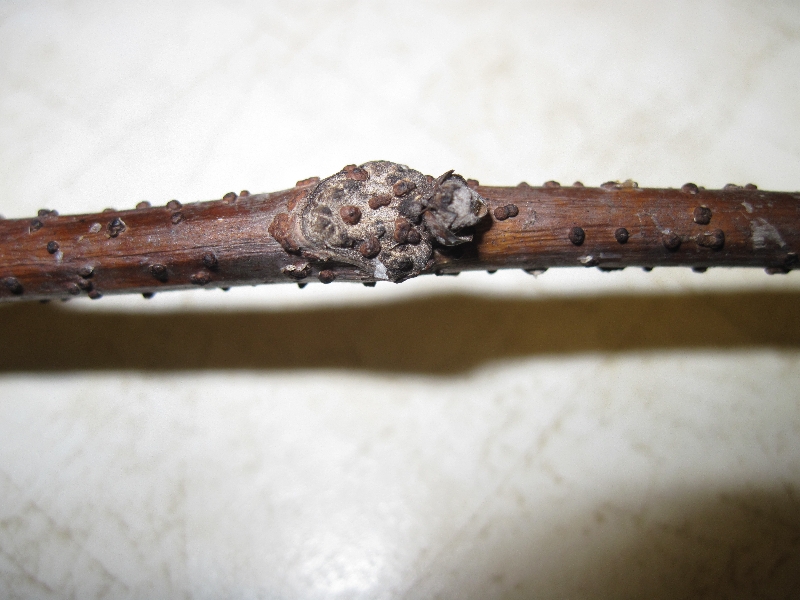
The width and height of the screenshot is (800, 600). Identify the location of bright part of floor. (358, 584).